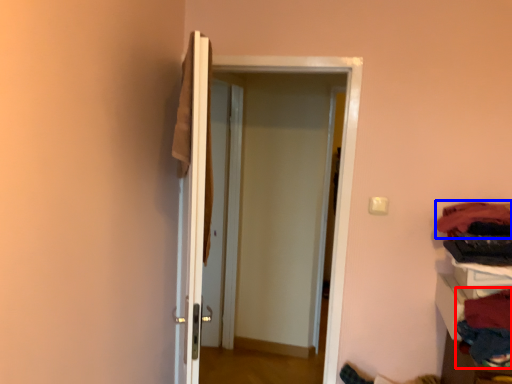
Question: Among these objects, which one is farthest to the camera, clothing (highlighted by a red box) or clothing (highlighted by a blue box)?

Choices:
 (A) clothing
 (B) clothing

Answer: (B)